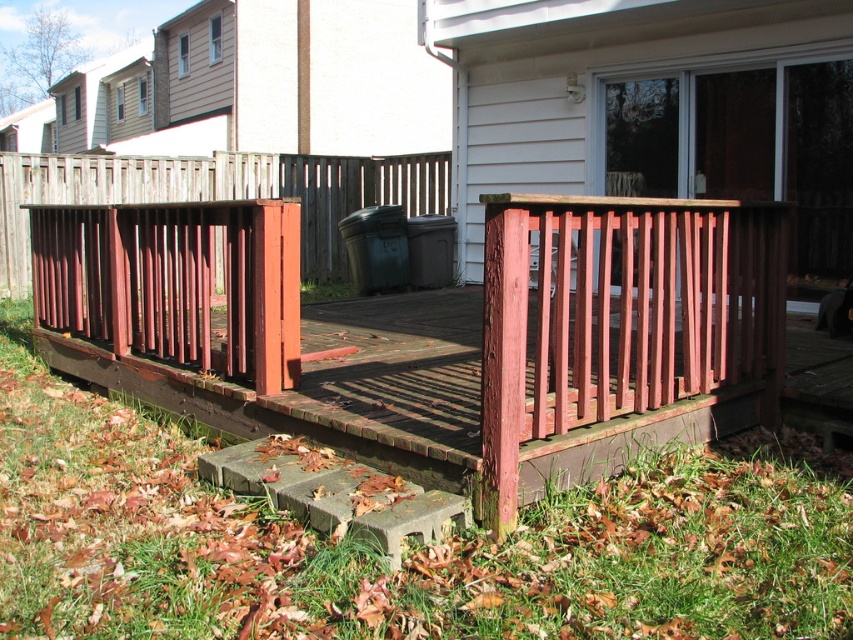
You are standing on the gray concrete step at lower left and want to reach the deck. Which direction should you move relative to the rustic wood railing at center?

Since the gray concrete step at lower left is behind the rustic wood railing at center, you should move forward towards the rustic wood railing at center to reach the deck.

You are a delivery person carrying a large package that is 24 inches wide. You need to walk from the wooden porch at center to the rustic wood railing at center. Can you pass through the space between them without tilting the package?

The distance between the wooden porch at center and the rustic wood railing at center is 20.38 inches. Since the package is 24 inches wide, it is wider than the available space. Therefore, you cannot pass through without tilting the package.

You are a delivery person carrying a package that is 1.5 meters long. You need to navigate through the backyard to reach the front door. Is the distance between the rustic wood railing at center and the gray concrete step at lower left sufficient to pass through with your package?

The rustic wood railing at center is 1.27 meters away from the gray concrete step at lower left. Since your package is 1.5 meters long, the distance between them is not enough to pass through safely. You should find another path.